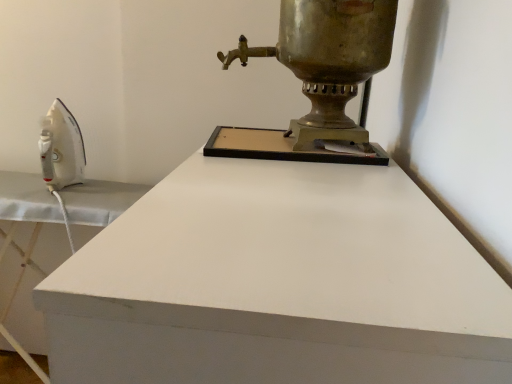
Find the location of a particular element. free space in front of shiny brass samovar at upper right is located at coordinates (295, 175).